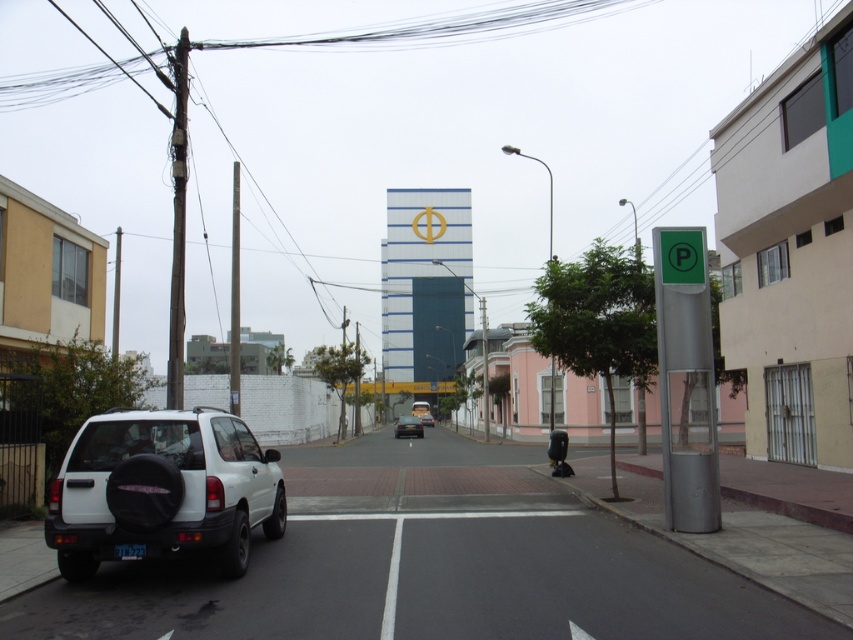
You are a delivery driver with a 2.5 meter wide truck. You need to park between the green metallic parking sign at right and the green plastic parking sign at right. Is there enough space for your truck?

The distance between the green metallic parking sign at right and the green plastic parking sign at right is 5.96 meters, so yes, the truck can fit since its width is 2.5 meters and the space is wider than that.

In the scene shown: You are standing at the point with coordinates point (265, 496) and want to walk to the point with coordinates point (677, 256). Which direction should you move in to reach your destination?

To reach point (677, 256) from point (265, 496), you should move to the left and upwards since point (265, 496) is in front of point (677, 256).